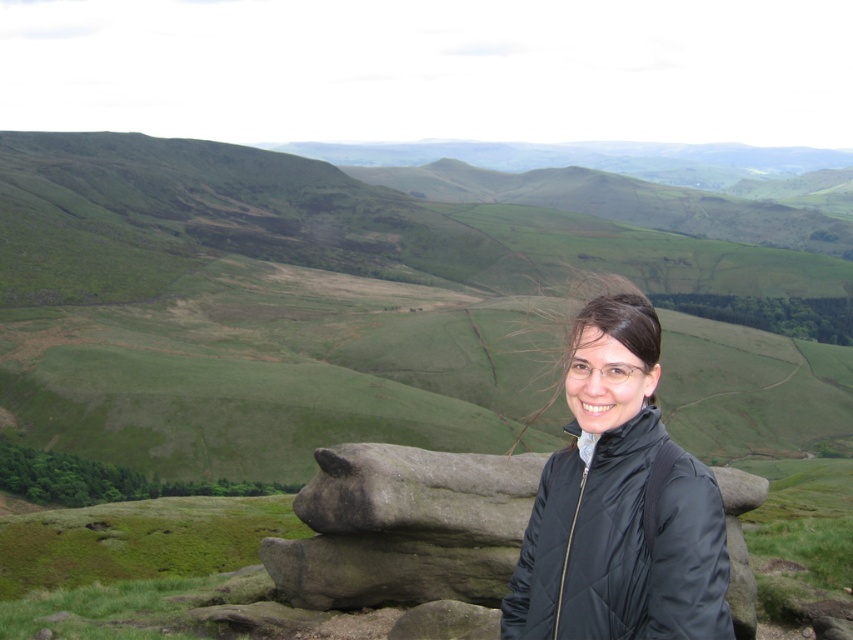
Is black quilted jacket at center smaller than rough stone boulder at center?

Correct, black quilted jacket at center occupies less space than rough stone boulder at center.

Between point (578, 452) and point (352, 529), which one is positioned behind?

The point (352, 529) is behind.

Find the location of `black quilted jacket at center`. black quilted jacket at center is located at coordinates (619, 502).

Who is positioned more to the right, green grassy hillside at center or rough stone boulder at center?

Positioned to the right is green grassy hillside at center.

Identify the location of green grassy hillside at center. (293, 304).

You are a GUI agent. You are given a task and a screenshot of the screen. Output one action in this format:
    pyautogui.click(x=<x>, y=<y>)
    Task: Click on the green grassy hillside at center
    The width and height of the screenshot is (853, 640).
    Given the screenshot: What is the action you would take?
    pyautogui.click(x=293, y=304)

Can you confirm if green grassy hillside at center is wider than black quilted jacket at center?

Yes.

Between green grassy hillside at center and black quilted jacket at center, which one appears on the left side from the viewer's perspective?

black quilted jacket at center is more to the left.

The image size is (853, 640). Find the location of `green grassy hillside at center`. green grassy hillside at center is located at coordinates (293, 304).